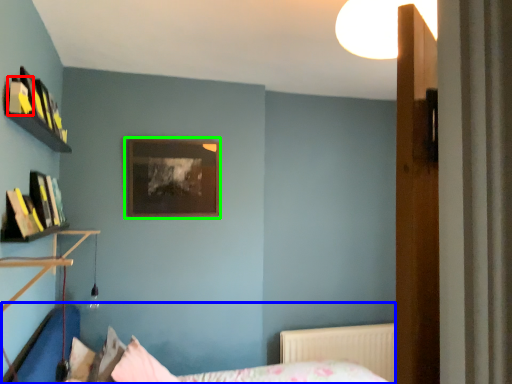
Question: Considering the real-world distances, which object is closest to book (highlighted by a red box)? bed (highlighted by a blue box) or picture frame (highlighted by a green box).

Choices:
 (A) bed
 (B) picture frame

Answer: (B)